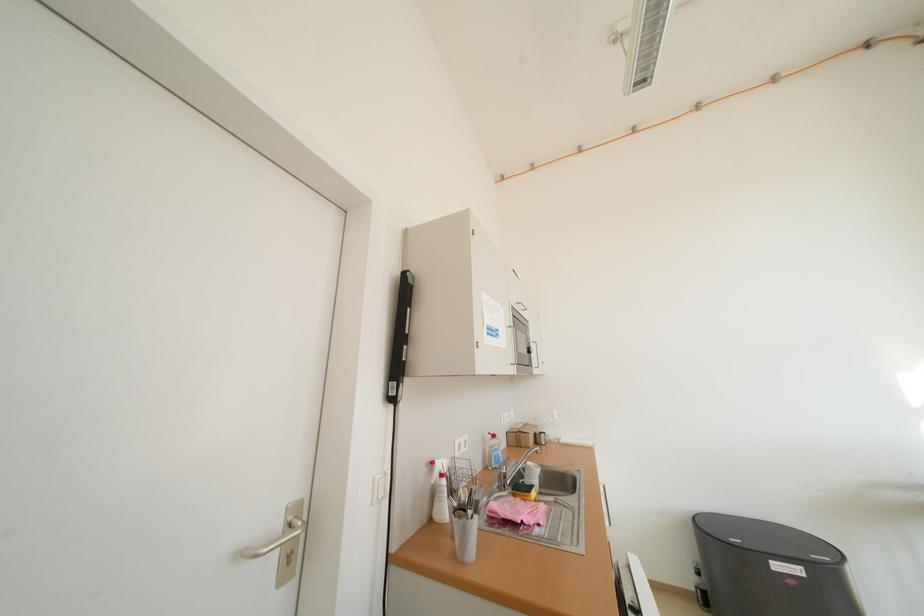
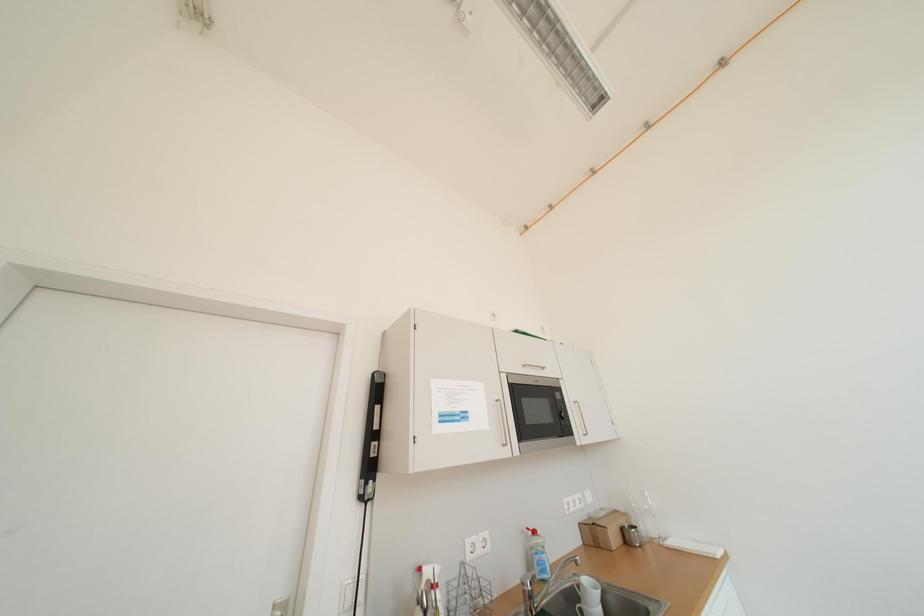
Question: The images are taken continuously from a first-person perspective. In which direction are you moving?

Choices:
 (A) Left
 (B) Right
 (C) Forward
 (D) Backward

Answer: (B)